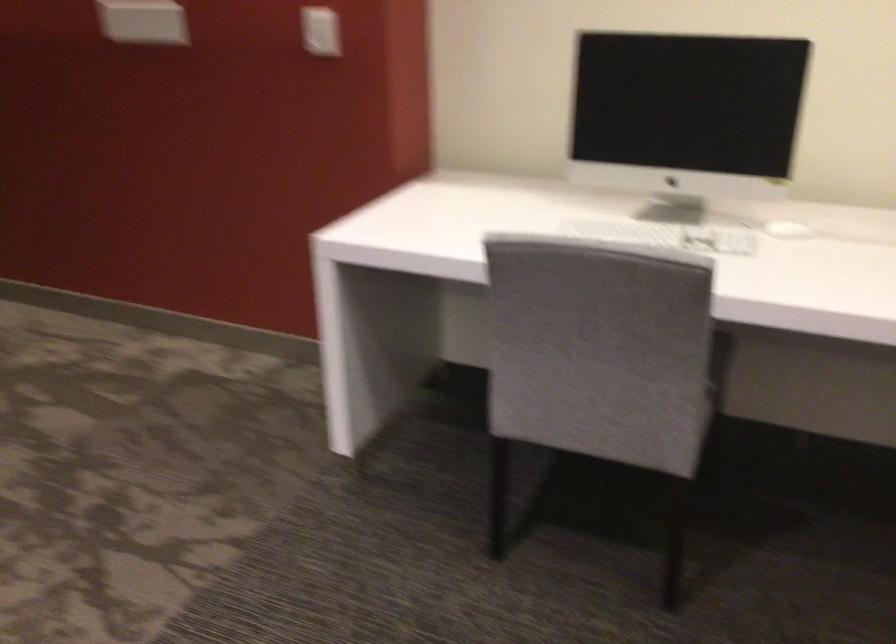
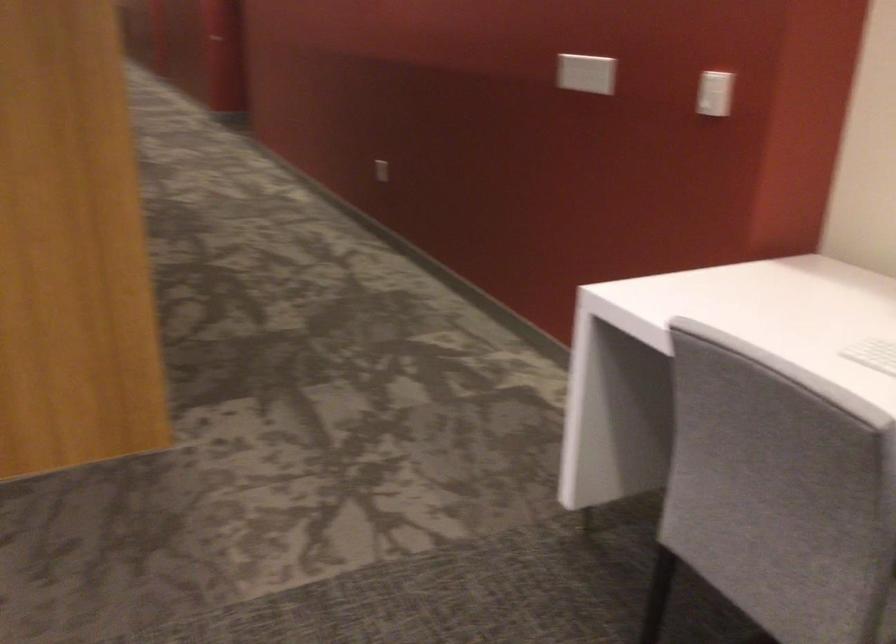
Question: The images are taken continuously from a first-person perspective. In which direction is your viewpoint rotating?

Choices:
 (A) Left
 (B) Right
 (C) Up
 (D) Down

Answer: (A)